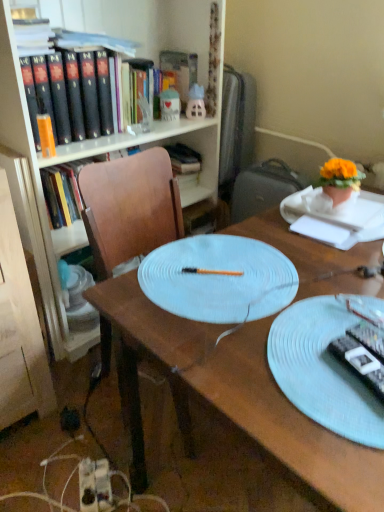
Locate an element on the screen. The width and height of the screenshot is (384, 512). free space in front of black plastic remote control at lower right, the 1th remote control positioned from the left is located at coordinates (353, 440).